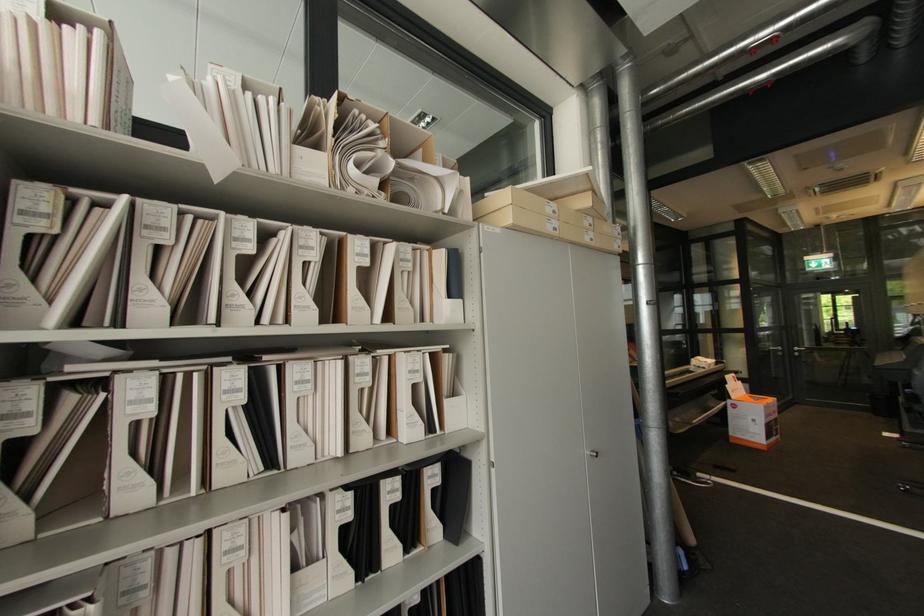
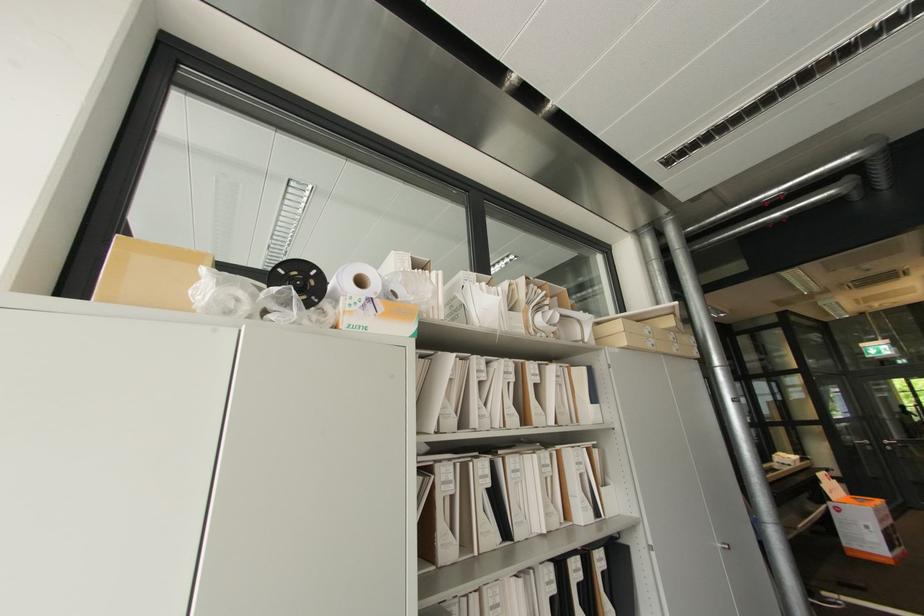
In a continuous first-person perspective shot, in which direction is the camera moving?

The movement direction of the cameraman is left, backward.